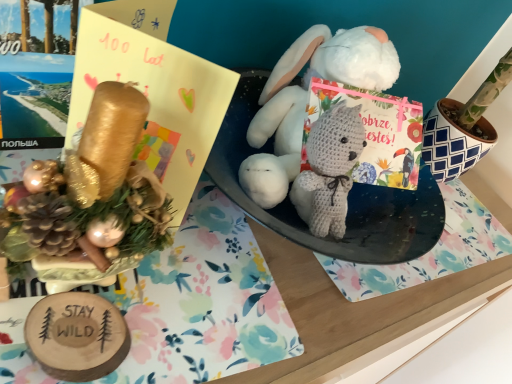
In the scene shown: Measure the distance between point (x=233, y=91) and camera.

They are 15.75 inches apart.

The image size is (512, 384). Describe the element at coordinates (152, 90) in the screenshot. I see `matte gold candle at left` at that location.

I want to click on matte gold candle at left, so click(152, 90).

What are the coordinates of `matte gold candle at left` in the screenshot? It's located at (152, 90).